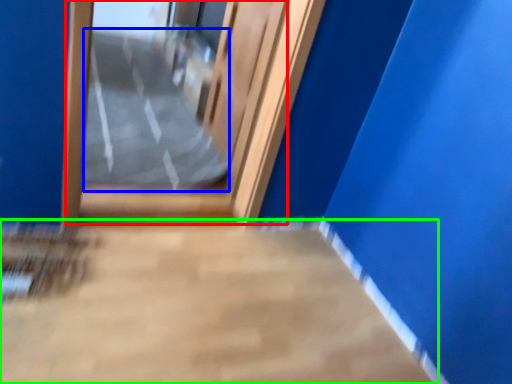
Question: Which object is positioned closest to door (highlighted by a red box)? Select from path (highlighted by a blue box) and concrete (highlighted by a green box).

Choices:
 (A) path
 (B) concrete

Answer: (A)